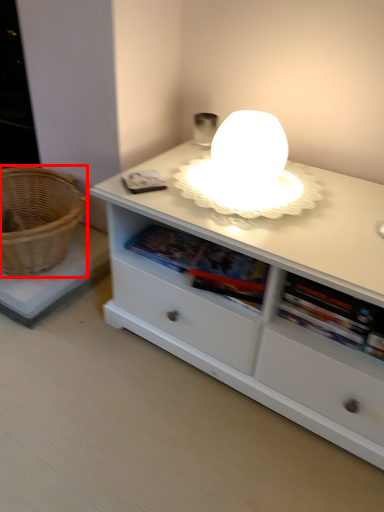
Question: From the image's perspective, what is the correct spatial positioning of basket (annotated by the red box) in reference to table?

Choices:
 (A) above
 (B) below

Answer: (A)